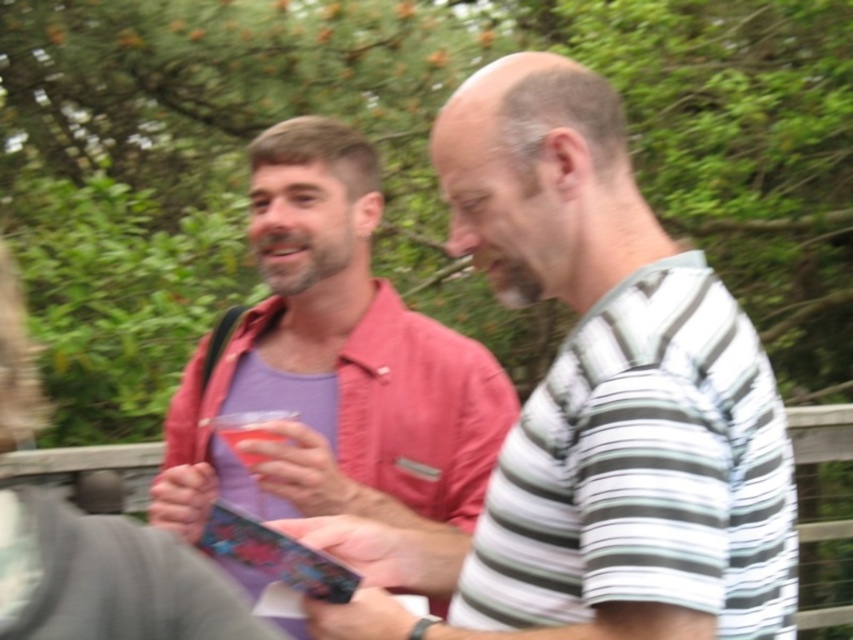
Question: Can you confirm if matte pink shirt at center is positioned below translucent plastic cup at center?

Choices:
 (A) yes
 (B) no

Answer: (B)

Question: Can you confirm if matte pink shirt at left is bigger than translucent plastic cup at center?

Choices:
 (A) yes
 (B) no

Answer: (A)

Question: Which of the following is the closest to the observer?

Choices:
 (A) matte pink shirt at center
 (B) translucent plastic cup at center

Answer: (A)

Question: Is matte pink shirt at center positioned before matte pink shirt at left?

Choices:
 (A) yes
 (B) no

Answer: (A)

Question: Among these points, which one is nearest to the camera?

Choices:
 (A) pos(431,506)
 (B) pos(688,564)

Answer: (B)

Question: Which object is the closest to the matte pink shirt at left?

Choices:
 (A) translucent plastic cup at center
 (B) matte pink shirt at center

Answer: (A)